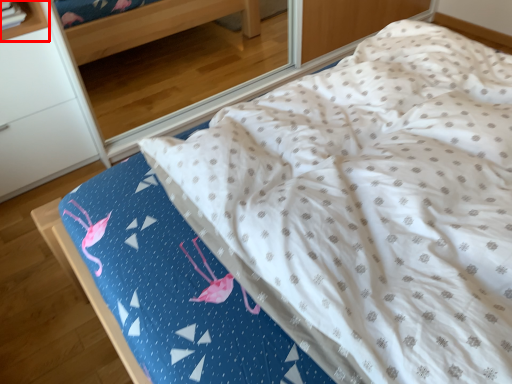
Question: Observing the image, what is the correct spatial positioning of shelf (annotated by the red box) in reference to furniture?

Choices:
 (A) right
 (B) left

Answer: (A)